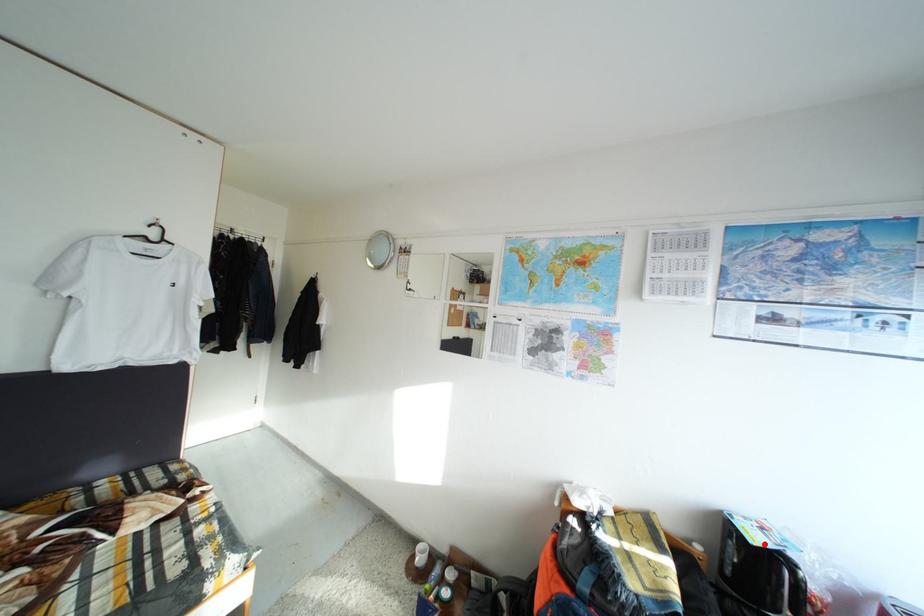
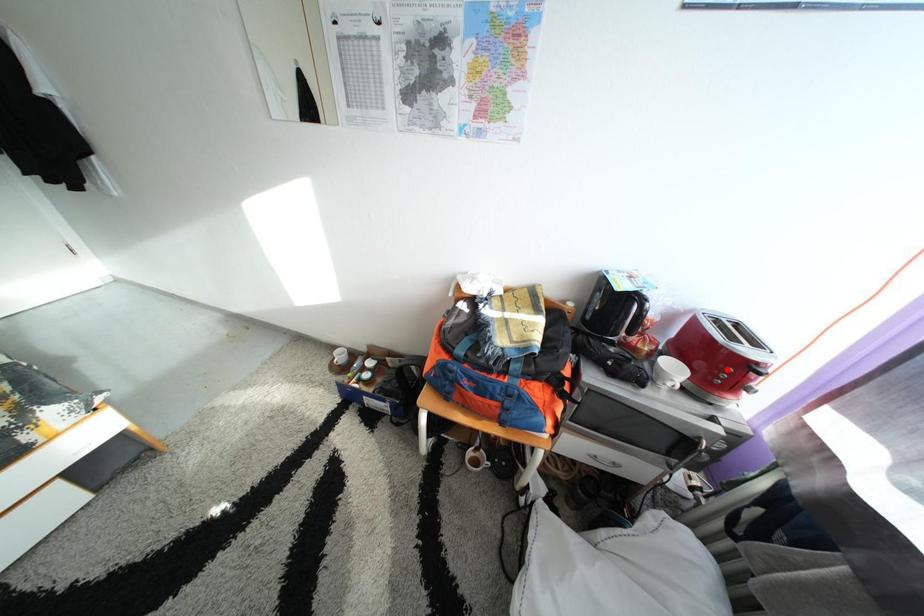
I am providing you with two images of the same scene from different viewpoints. A red point is marked on the first image and another point is marked on the second image. Is the marked point in image1 the same physical position as the marked point in image2?

No